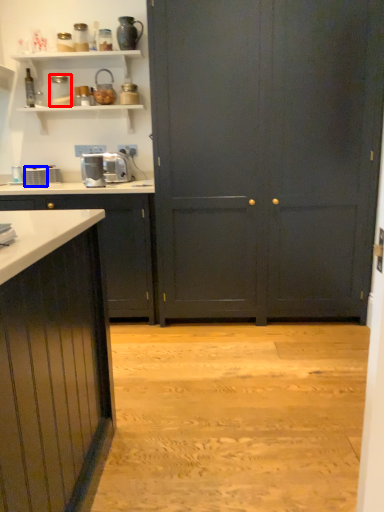
Question: Among these objects, which one is farthest to the camera, appliance (highlighted by a red box) or appliance (highlighted by a blue box)?

Choices:
 (A) appliance
 (B) appliance

Answer: (A)